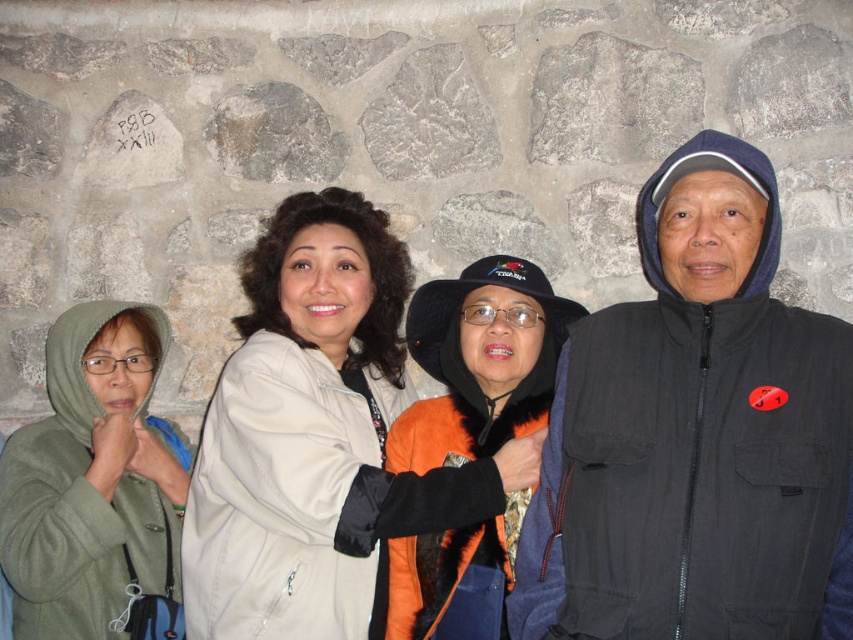
Which is above, black fabric jacket at right or orange fuzzy jacket at center?

orange fuzzy jacket at center

Who is shorter, black fabric jacket at right or orange fuzzy jacket at center?

Standing shorter between the two is orange fuzzy jacket at center.

What are the coordinates of `black fabric jacket at right` in the screenshot? It's located at (695, 436).

Who is taller, green fleece jacket at lower left or orange fuzzy jacket at center?

green fleece jacket at lower left is taller.

Is point (131, 458) less distant than point (489, 368)?

No.

Who is more distant from viewer, [67,314] or [386,627]?

The point [67,314] is more distant.

Identify the location of green fleece jacket at lower left. (x=91, y=481).

Is black fabric jacket at right positioned at the back of green fleece jacket at lower left?

No, it is in front of green fleece jacket at lower left.

Can you confirm if black fabric jacket at right is positioned below green fleece jacket at lower left?

No, black fabric jacket at right is not below green fleece jacket at lower left.

Locate an element on the screen. Image resolution: width=853 pixels, height=640 pixels. black fabric jacket at right is located at coordinates (695, 436).